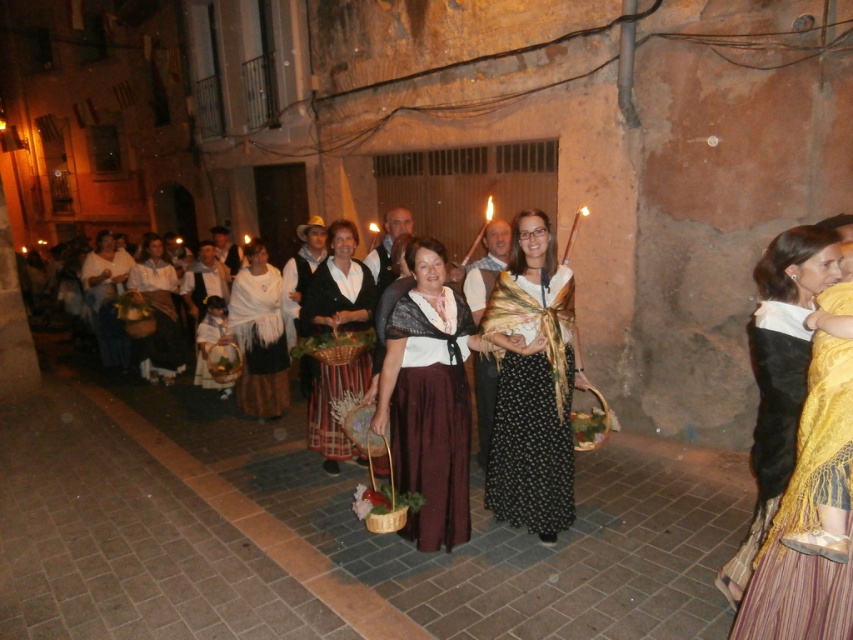
From the picture: You are part of the procession and want to find your friend who is wearing a striped cotton skirt at center. You see a matte brown skirt at center nearby. Which direction should you move to locate your friend?

The matte brown skirt at center is to the right of the striped cotton skirt at center, so you should move to your left to locate your friend wearing the striped cotton skirt at center.

Consider the image. You are a photographer standing in the middle of the street during the procession. You want to capture a photo that includes both the gold woven shawl at center and the striped cotton skirt at center. Which one will appear closer to the camera in the photo?

The gold woven shawl at center is in front of the striped cotton skirt at center, so it will appear closer to the camera in the photo.

You are a photographer positioned at the front of the procession. You want to capture both the matte brown skirt at center and the striped cotton skirt at center in a single frame. Which skirt should you focus on to ensure both are visible in the photo?

The matte brown skirt at center is in front of the striped cotton skirt at center, so focusing on the matte brown skirt at center will allow both to be visible as it is closer to the camera.